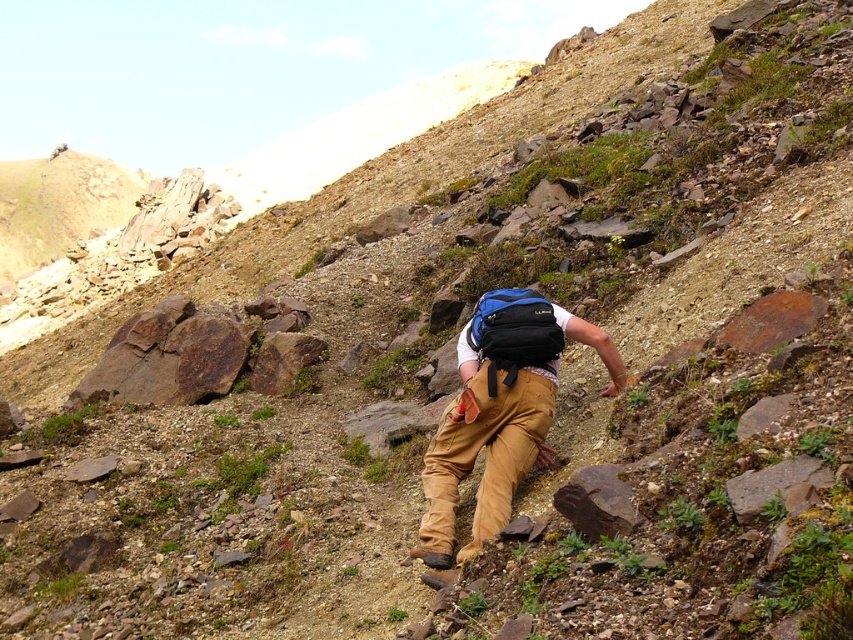
You are an outdoor guide assessing the safety of the climbing path. You notice the matte black backpack at center and the rusty metallic rock at lower center. Which object is more likely to be stable for a climber to use as a handhold?

The rusty metallic rock at lower center is more likely to be stable for a climber to use as a handhold because it is smaller in size compared to the matte black backpack at center, which may shift or move under pressure.

You are a hiker trying to navigate the steep hillside shown in the image. You need to place a marker between the khaki pants at center and the blue fabric backpack at center to indicate the safest path. Which object should the marker be closer to?

The marker should be closer to the khaki pants at center because it is closer to the viewer than the blue fabric backpack at center, indicating a safer, more accessible path.

You are a hiker trying to locate your gear in the image. Where is the khaki pants at center positioned in terms of coordinates?

The khaki pants at center is located at coordinates point (485, 460).